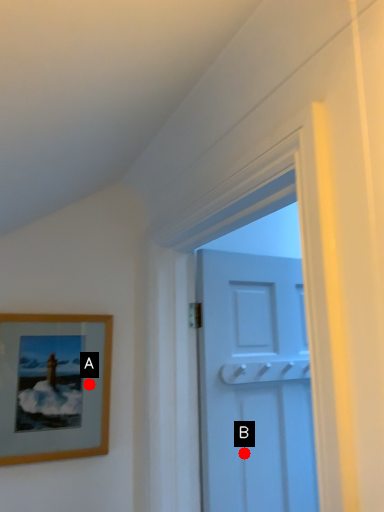
Question: Two points are circled on the image, labeled by A and B beside each circle. Which point is closer to the camera?

Choices:
 (A) A is closer
 (B) B is closer

Answer: (A)